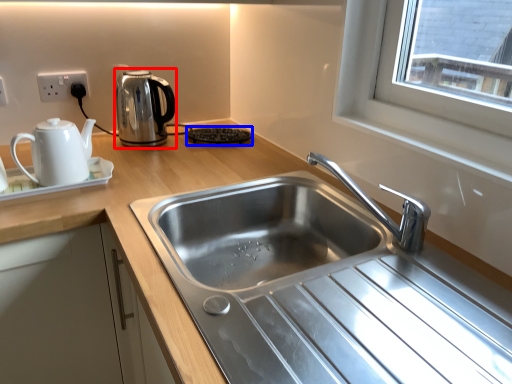
Question: Which object is further to the camera taking this photo, kettle (highlighted by a red box) or appliance (highlighted by a blue box)?

Choices:
 (A) kettle
 (B) appliance

Answer: (B)